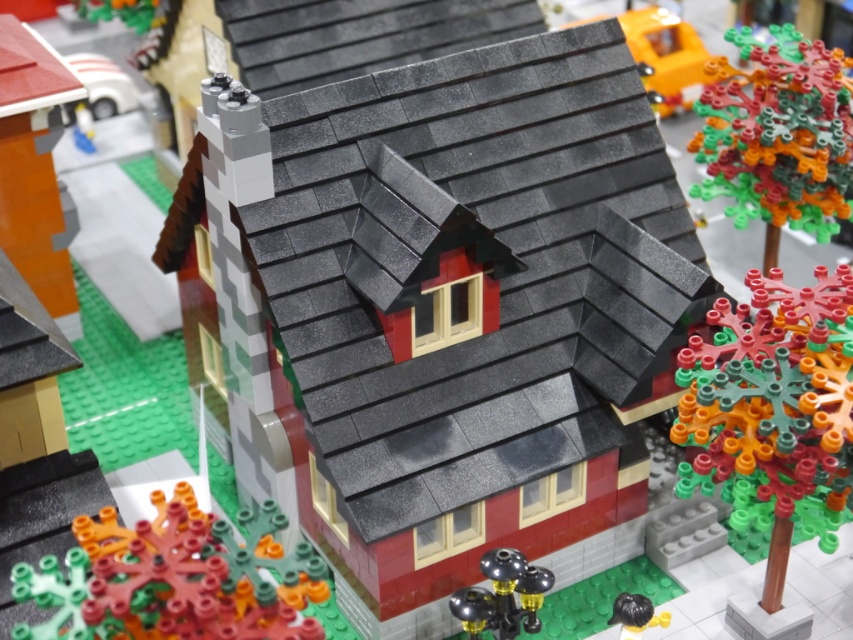
Question: Which point is farther to the camera?

Choices:
 (A) (640, 620)
 (B) (549, 577)

Answer: (A)

Question: Can you confirm if translucent orange coral at lower left is bigger than metallic silver lamp post at lower center?

Choices:
 (A) no
 (B) yes

Answer: (B)

Question: Which point is closer to the camera taking this photo?

Choices:
 (A) (712, 474)
 (B) (186, 540)

Answer: (B)

Question: Is translucent orange coral at lower left further to the viewer compared to metallic silver lamp post at lower center?

Choices:
 (A) yes
 (B) no

Answer: (B)

Question: Considering the relative positions of multicolored plastic tree at upper right and black rubber hair at lower right in the image provided, where is multicolored plastic tree at upper right located with respect to black rubber hair at lower right?

Choices:
 (A) below
 (B) above

Answer: (B)

Question: Which object is farther from the camera taking this photo?

Choices:
 (A) metallic silver lamp post at lower center
 (B) smooth red brick house at center

Answer: (B)